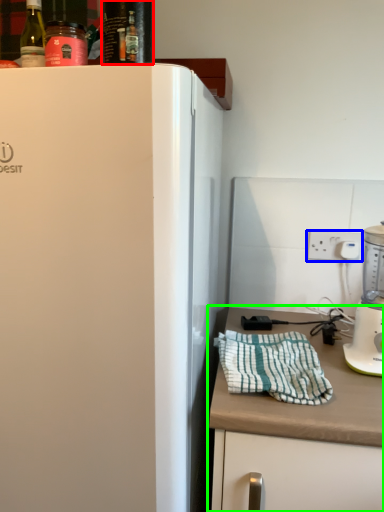
Question: Considering the real-world distances, which object is farthest from beverage (highlighted by a red box)? electric outlet (highlighted by a blue box) or countertop (highlighted by a green box)?

Choices:
 (A) electric outlet
 (B) countertop

Answer: (A)